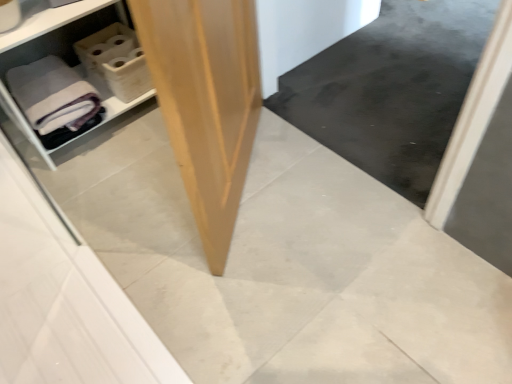
Question: Does white plastic shelf at left appear on the right side of gray matte bath towel at left?

Choices:
 (A) no
 (B) yes

Answer: (B)

Question: Considering the relative sizes of white plastic shelf at left and gray matte bath towel at left in the image provided, is white plastic shelf at left taller than gray matte bath towel at left?

Choices:
 (A) no
 (B) yes

Answer: (B)

Question: Is gray matte bath towel at left at the back of white plastic shelf at left?

Choices:
 (A) yes
 (B) no

Answer: (A)

Question: Is white plastic shelf at left wider than gray matte bath towel at left?

Choices:
 (A) yes
 (B) no

Answer: (B)

Question: Are white plastic shelf at left and gray matte bath towel at left beside each other?

Choices:
 (A) no
 (B) yes

Answer: (A)

Question: Is the position of white plastic shelf at left more distant than that of gray matte bath towel at left?

Choices:
 (A) no
 (B) yes

Answer: (A)

Question: Is light brown plywood at center facing towards white plastic shelf at left?

Choices:
 (A) yes
 (B) no

Answer: (B)

Question: From the image's perspective, is light brown plywood at center below white plastic shelf at left?

Choices:
 (A) no
 (B) yes

Answer: (B)

Question: Is light brown plywood at center to the left of white plastic shelf at left from the viewer's perspective?

Choices:
 (A) no
 (B) yes

Answer: (A)

Question: Does light brown plywood at center have a lesser width compared to white plastic shelf at left?

Choices:
 (A) yes
 (B) no

Answer: (A)

Question: Is the surface of light brown plywood at center in direct contact with white plastic shelf at left?

Choices:
 (A) yes
 (B) no

Answer: (B)

Question: Is light brown plywood at center to the right of white plastic shelf at left from the viewer's perspective?

Choices:
 (A) no
 (B) yes

Answer: (B)

Question: From the image's perspective, is white plastic shelf at left under light brown plywood at center?

Choices:
 (A) yes
 (B) no

Answer: (B)